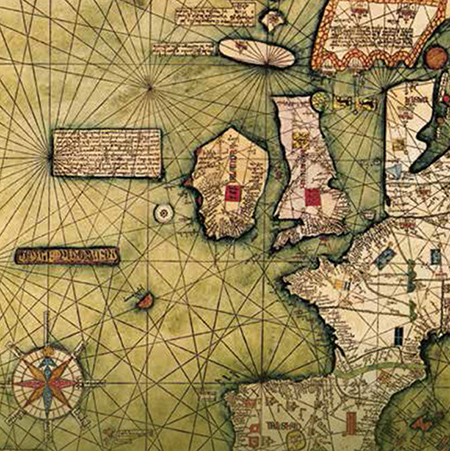
Locate an element on the screen. The height and width of the screenshot is (451, 450). writing blocks is located at coordinates (207, 18), (111, 149), (178, 49), (372, 33).